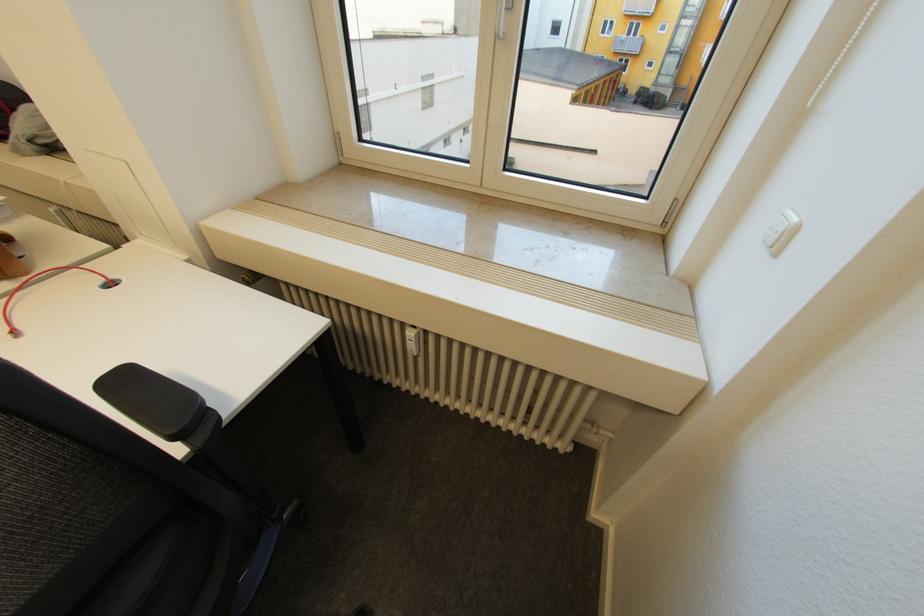
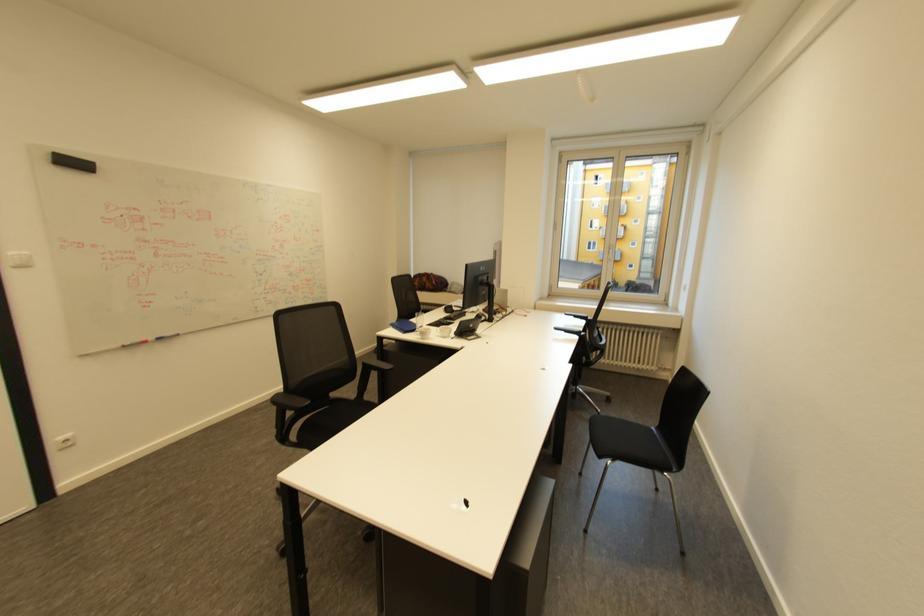
The point at (649, 87) is marked in the first image. Where is the corresponding point in the second image?

(636, 281)